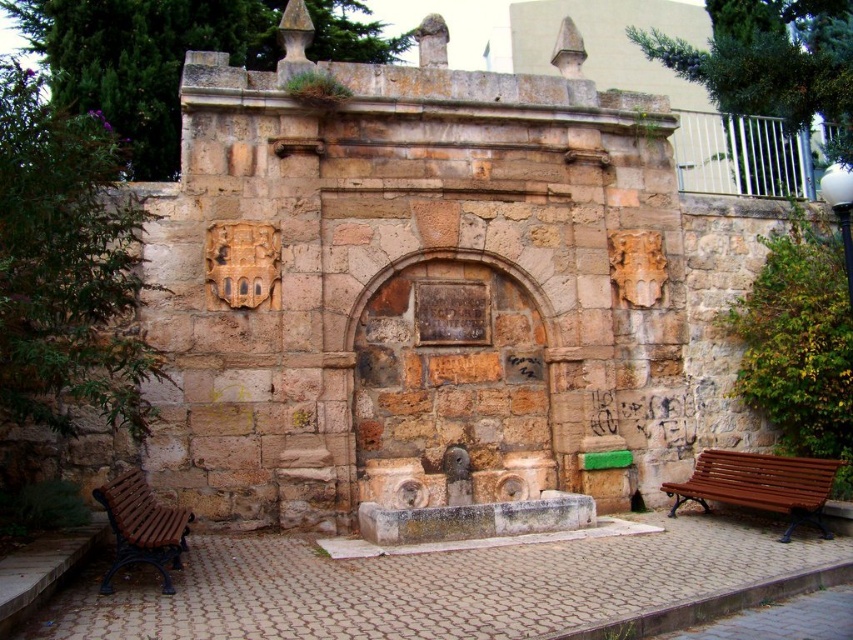
Who is more distant from viewer, (781, 490) or (141, 474)?

Point (781, 490)

Does brown wooden bench at lower right appear under brown wooden bench at lower left?

Yes.

The image size is (853, 640). What are the coordinates of `brown wooden bench at lower right` in the screenshot? It's located at (759, 484).

Locate an element on the screen. brown wooden bench at lower right is located at coordinates (759, 484).